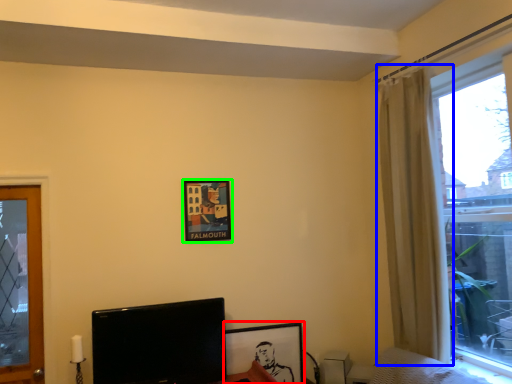
Question: Which object is the closest to the picture frame (highlighted by a red box)? Choose among these: curtain (highlighted by a blue box) or picture frame (highlighted by a green box).

Choices:
 (A) curtain
 (B) picture frame

Answer: (B)